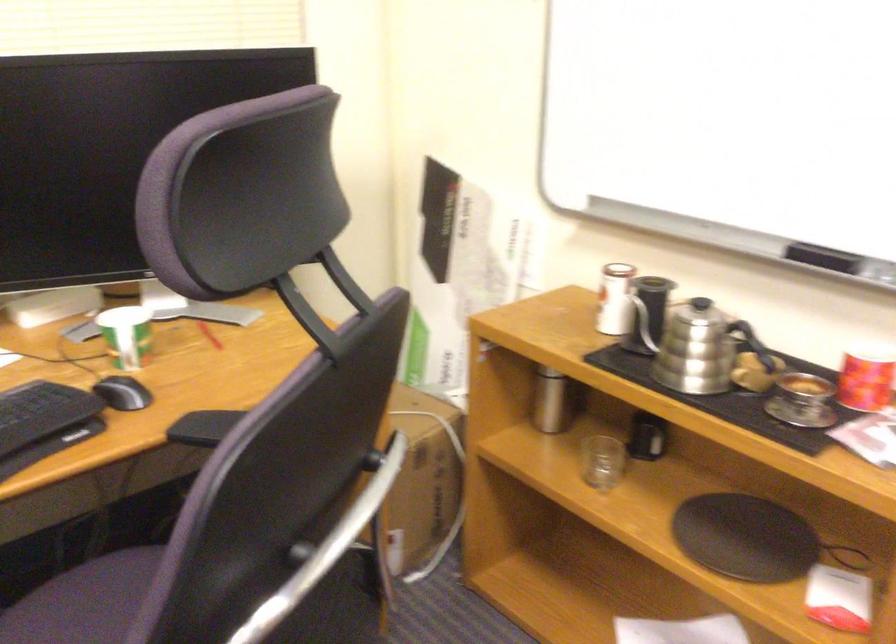
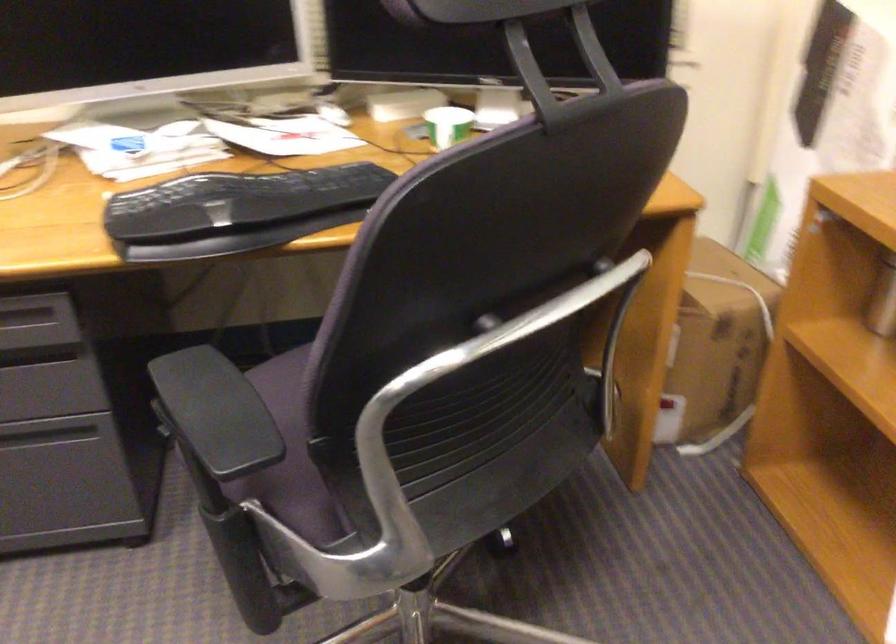
Question: The camera is either moving clockwise (left) or counter-clockwise (right) around the object. The first image is from the beginning of the video and the second image is from the end. Is the camera moving left or right when shooting the video?

Choices:
 (A) Left
 (B) Right

Answer: (B)